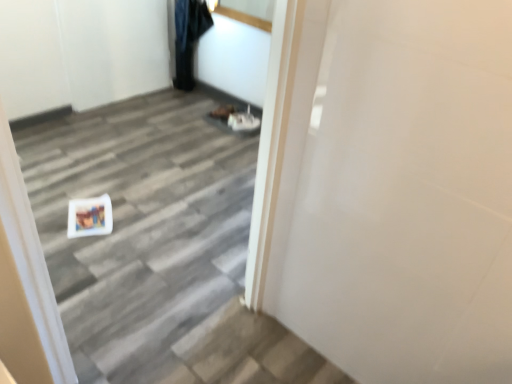
This screenshot has width=512, height=384. I want to click on free space in front of denim pants at upper center, so click(x=178, y=105).